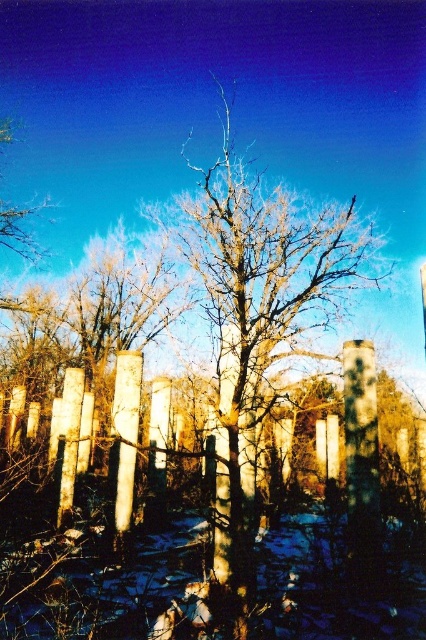
Does white smooth pillar at center have a greater height compared to wooden post at center?

Correct, white smooth pillar at center is much taller as wooden post at center.

Is point (129, 362) more distant than point (66, 461)?

No, (129, 362) is in front of (66, 461).

Does point (117, 513) come behind point (60, 481)?

No, (117, 513) is in front of (60, 481).

Identify the location of white smooth pillar at center. This screenshot has width=426, height=640. (126, 429).

Looking at this image, which is below, bare wood tree at center or white smooth pillar at center?

white smooth pillar at center is lower down.

The width and height of the screenshot is (426, 640). What are the coordinates of `bare wood tree at center` in the screenshot? It's located at (261, 291).

In order to click on bare wood tree at center in this screenshot , I will do `click(261, 291)`.

Can you confirm if bare wood tree at center is positioned to the left of wooden post at center?

In fact, bare wood tree at center is to the right of wooden post at center.

Can you confirm if bare wood tree at center is smaller than wooden post at center?

No, bare wood tree at center is not smaller than wooden post at center.

This screenshot has width=426, height=640. Identify the location of bare wood tree at center. (261, 291).